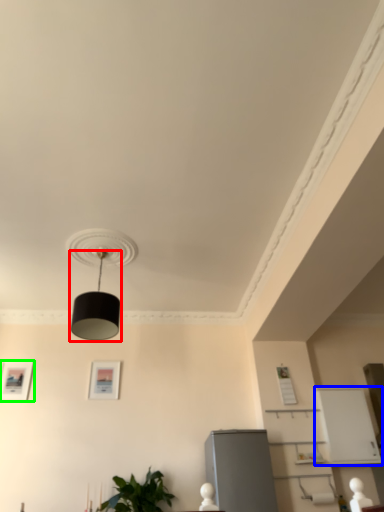
Question: Which object is positioned farthest from lamp (highlighted by a red box)? Select from shelf (highlighted by a blue box) and picture frame (highlighted by a green box).

Choices:
 (A) shelf
 (B) picture frame

Answer: (A)